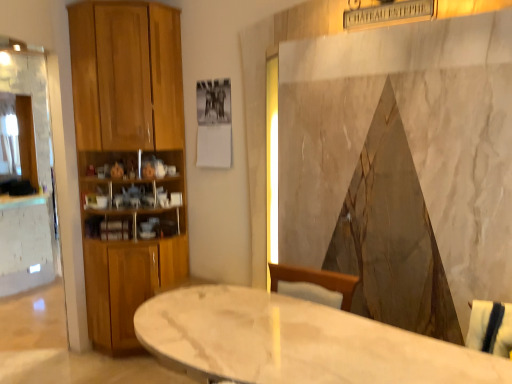
Question: Considering the positions of wooden cabinet at left and white marble table at center in the image, is wooden cabinet at left bigger or smaller than white marble table at center?

Choices:
 (A) big
 (B) small

Answer: (A)

Question: Is wooden cabinet at left wider or thinner than white marble table at center?

Choices:
 (A) thin
 (B) wide

Answer: (A)

Question: From a real-world perspective, is wooden cabinet at left physically located above or below white marble table at center?

Choices:
 (A) below
 (B) above

Answer: (B)

Question: From the image's perspective, relative to wooden cabinet at left, is white marble table at center above or below?

Choices:
 (A) above
 (B) below

Answer: (B)

Question: Considering the positions of white marble table at center and wooden cabinet at left in the image, is white marble table at center taller or shorter than wooden cabinet at left?

Choices:
 (A) short
 (B) tall

Answer: (A)

Question: Does point (195, 321) appear closer or farther from the camera than point (156, 91)?

Choices:
 (A) closer
 (B) farther

Answer: (A)

Question: In terms of width, does white marble table at center look wider or thinner when compared to wooden cabinet at left?

Choices:
 (A) wide
 (B) thin

Answer: (A)